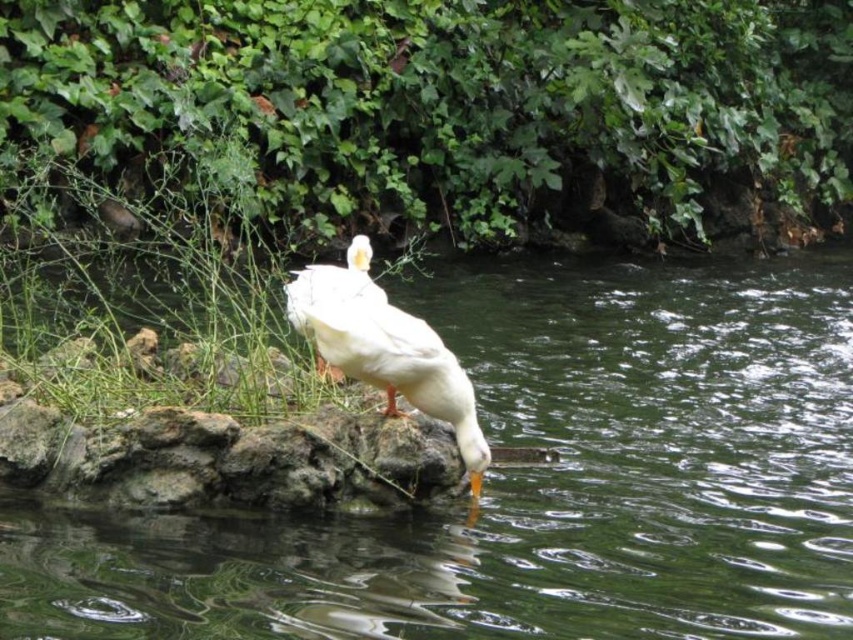
Question: Does clear liquid water at center appear on the right side of white matte duck at center?

Choices:
 (A) yes
 (B) no

Answer: (A)

Question: Which point is farther to the camera?

Choices:
 (A) white matte duck at center
 (B) clear liquid water at center

Answer: (A)

Question: Does clear liquid water at center come in front of white matte duck at center?

Choices:
 (A) yes
 (B) no

Answer: (A)

Question: Is clear liquid water at center positioned in front of white matte duck at center?

Choices:
 (A) no
 (B) yes

Answer: (B)